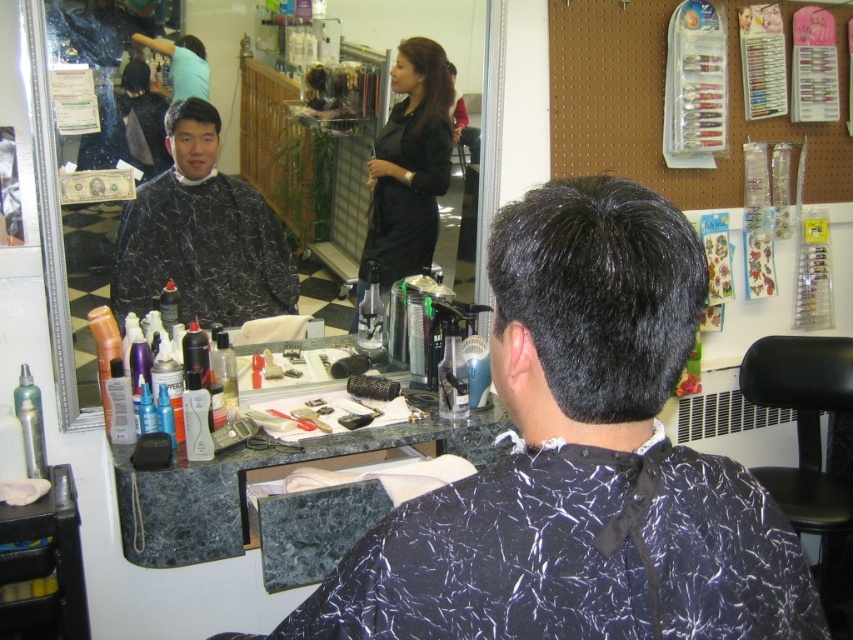
You are a customer in the hair salon and want to choose between the smooth dark brown hair at upper center and the matte black hair at upper center. Which one is located below the other?

The smooth dark brown hair at upper center is positioned under the matte black hair at upper center, so the smooth dark brown hair at upper center is below the matte black hair at upper center.

You are a customer entering the hair salon and see the black satin dress at center and the black marble hairdresser cape at upper left. Which object is closer to the entrance?

The black marble hairdresser cape at upper left is closer to the entrance because the black satin dress at center is to the right of it, implying the cape is positioned nearer to the entrance area.